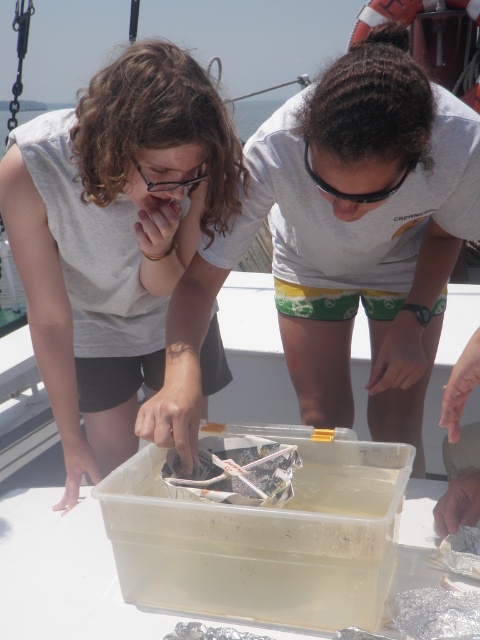
Does black plastic goggles at center have a larger size compared to clear plastic goggles at center?

Correct, black plastic goggles at center is larger in size than clear plastic goggles at center.

Is black plastic goggles at center positioned behind clear plastic goggles at center?

That is False.

Which is in front, point (317, 186) or point (136, 163)?

Positioned in front is point (136, 163).

You are a GUI agent. You are given a task and a screenshot of the screen. Output one action in this format:
    pyautogui.click(x=<x>, y=<y>)
    Task: Click on the black plastic goggles at center
    The width and height of the screenshot is (480, 640).
    Given the screenshot: What is the action you would take?
    pyautogui.click(x=347, y=193)

Is white matte plastic container at center bigger than clear plastic bag at center?

Correct, white matte plastic container at center is larger in size than clear plastic bag at center.

Does point (374, 384) come farther from viewer compared to point (262, 442)?

Yes, it is.

Where is `white matte plastic container at center`? The image size is (480, 640). white matte plastic container at center is located at coordinates (342, 244).

Which is above, transparent plastic container at center or clear plastic goggles at center?

Positioned higher is clear plastic goggles at center.

Which of these two, transparent plastic container at center or clear plastic goggles at center, stands shorter?

With less height is clear plastic goggles at center.

Is point (166, 531) farther from camera compared to point (160, 186)?

No, (166, 531) is closer to viewer.

Where is `transparent plastic container at center`? This screenshot has height=640, width=480. transparent plastic container at center is located at coordinates (263, 529).